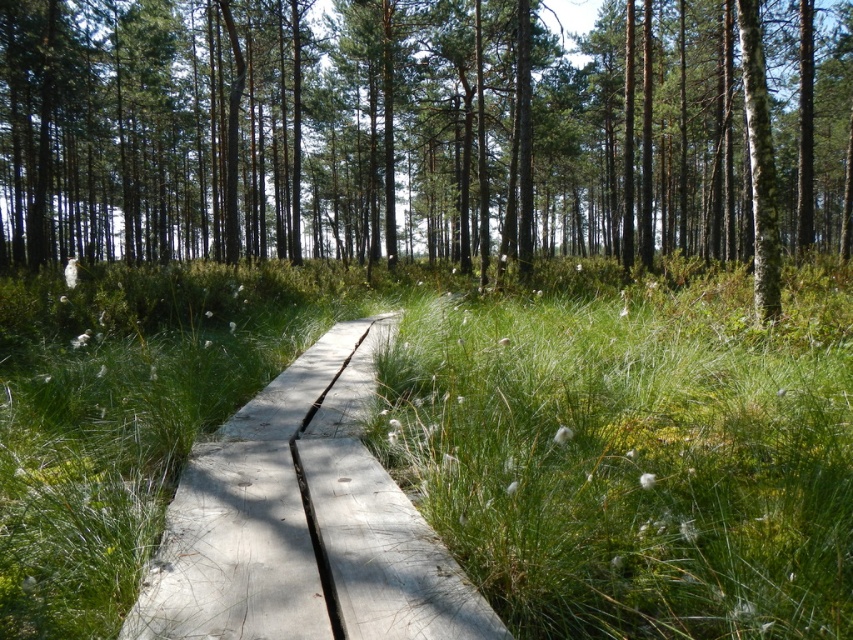
Who is more forward, (x=761, y=419) or (x=192, y=499)?

Point (x=192, y=499) is more forward.

Does point (6, 547) come behind point (193, 492)?

That is False.

Locate an element on the screen. green grassy at center is located at coordinates (460, 436).

Can you confirm if brown wood tree at center is taller than light gray wooden path at center?

Indeed, brown wood tree at center has a greater height compared to light gray wooden path at center.

Can you confirm if brown wood tree at center is positioned to the right of light gray wooden path at center?

Indeed, brown wood tree at center is positioned on the right side of light gray wooden path at center.

Who is more forward, (239, 195) or (328, 369)?

Point (328, 369) is more forward.

Where is `brown wood tree at center`? brown wood tree at center is located at coordinates (422, 132).

Is green grassy at center above brown wood tree at center?

Actually, green grassy at center is below brown wood tree at center.

Does green grassy at center lie in front of brown wood tree at center?

Yes, it is in front of brown wood tree at center.

Who is more forward, (514,461) or (440,148)?

Point (514,461) is more forward.

The width and height of the screenshot is (853, 640). I want to click on green grassy at center, so click(460, 436).